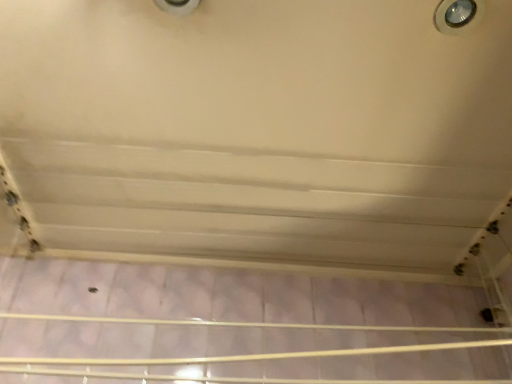
Where is `free space behind matte white light fixture at upper right`? This screenshot has height=384, width=512. free space behind matte white light fixture at upper right is located at coordinates (434, 93).